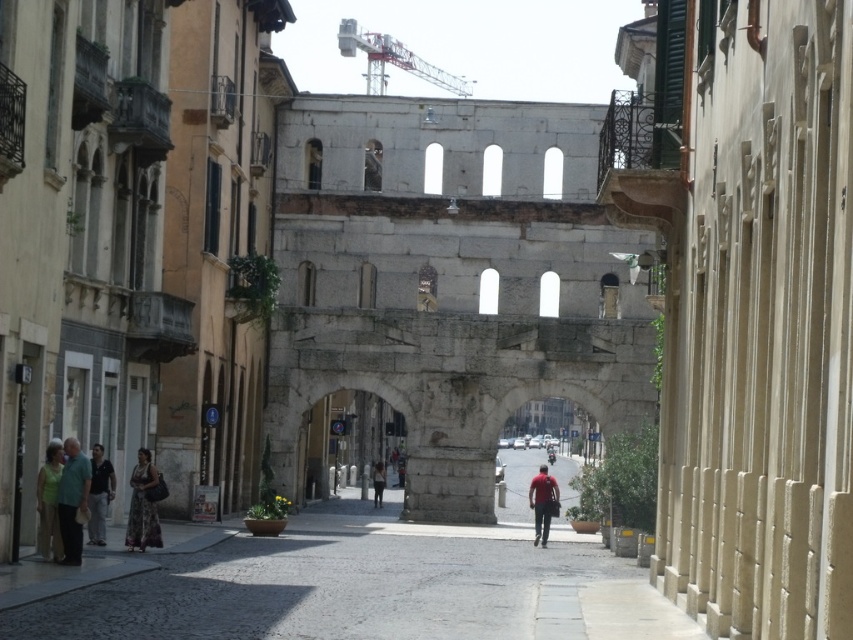
You are standing in front of the historic stone archway in the urban scene. There are two points marked on the archway structure. The first point is at coordinates point (279,540) and the second is at point (141,451). Which of these points appears closer to you from your current viewpoint?

Point (279,540) is further to the camera than point (141,451), so the second point at point (141,451) appears closer to you.